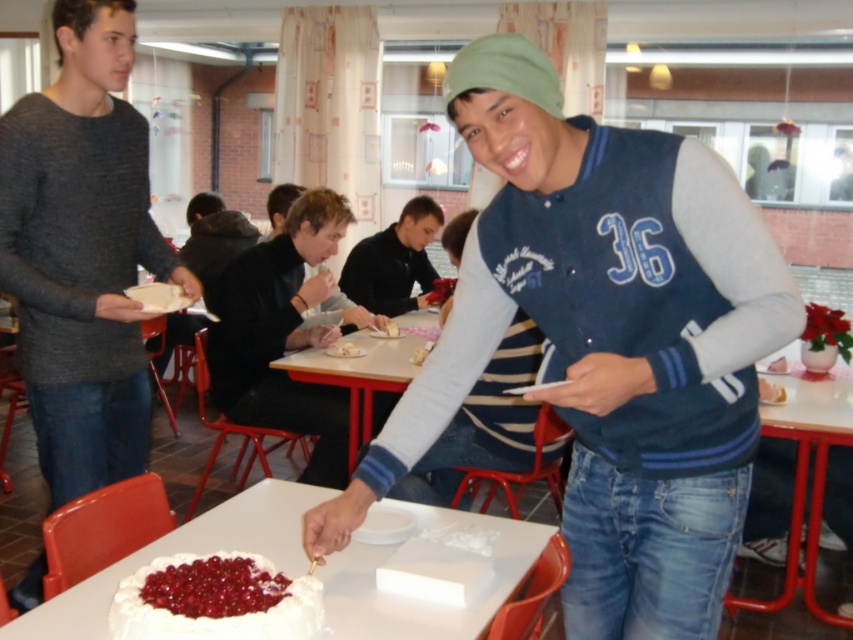
Question: Which of the following is the farthest from the observer?

Choices:
 (A) blue jersey at center
 (B) white plastic table at lower right
 (C) black leather jacket at center

Answer: (C)

Question: Can you confirm if wooden table at center is bigger than shiny red berries at lower left?

Choices:
 (A) no
 (B) yes

Answer: (B)

Question: Which point appears farthest from the camera in this image?

Choices:
 (A) (392, 372)
 (B) (194, 604)

Answer: (A)

Question: Considering the relative positions of dark blue striped shirt at center and white creamy cake at center in the image provided, where is dark blue striped shirt at center located with respect to white creamy cake at center?

Choices:
 (A) right
 (B) left

Answer: (A)

Question: Among these objects, which one is farthest from the camera?

Choices:
 (A) blue jersey at center
 (B) white matte table at center
 (C) white creamy cake at center
 (D) dark blue striped shirt at center

Answer: (D)

Question: Does black leather jacket at center have a greater width compared to wooden table at center?

Choices:
 (A) no
 (B) yes

Answer: (A)